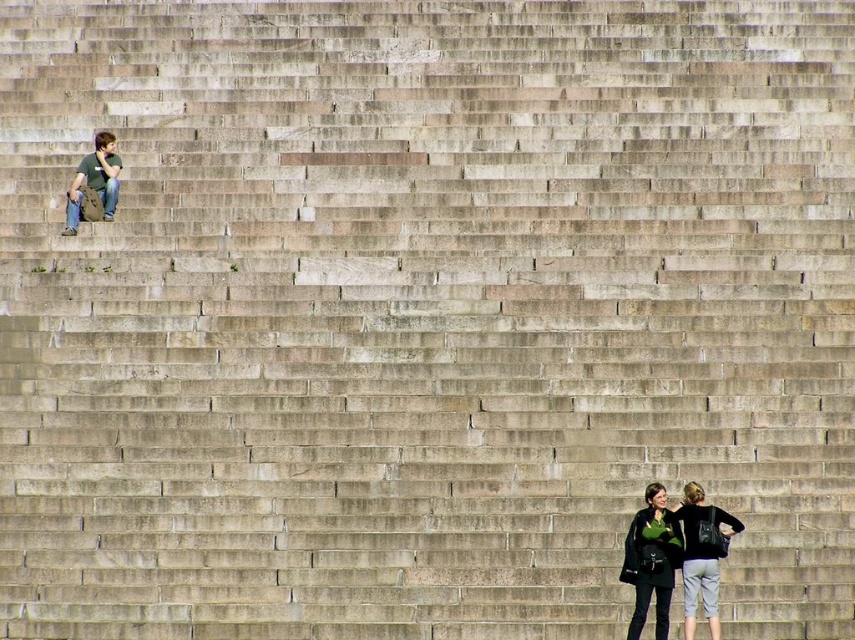
Question: Among these objects, which one is farthest from the camera?

Choices:
 (A) green fabric jacket at lower right
 (B) matte green shirt at upper left

Answer: (B)

Question: Is green fabric jacket at lower right behind matte green shirt at upper left?

Choices:
 (A) yes
 (B) no

Answer: (B)

Question: Can you confirm if green fabric jacket at lower right is wider than matte green shirt at upper left?

Choices:
 (A) yes
 (B) no

Answer: (A)

Question: Can you confirm if green fabric jacket at lower right is wider than matte green shirt at upper left?

Choices:
 (A) no
 (B) yes

Answer: (B)